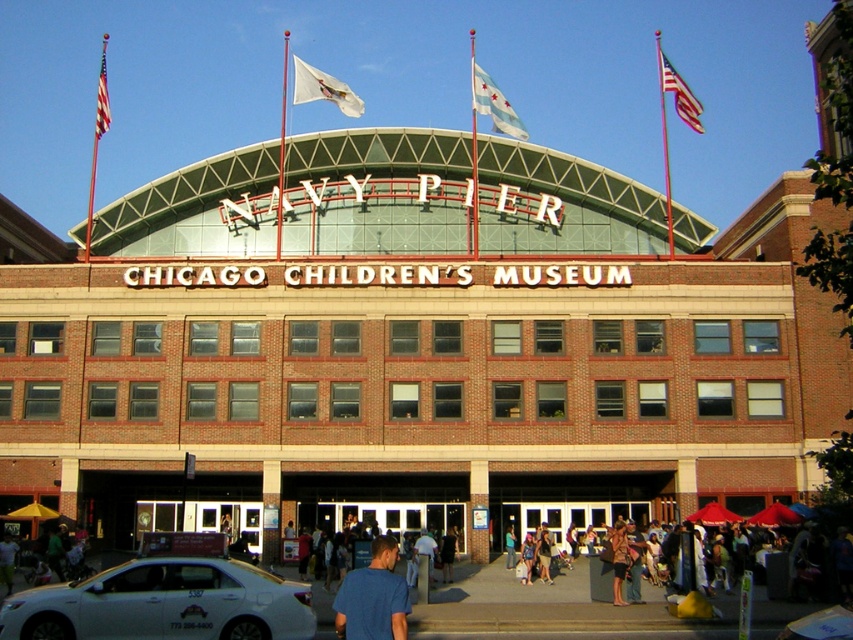
Consider the image. You are standing at the entrance of the Chicago Childrens Museum and see the white glossy sedan at lower left. If you walk straight towards the car, how far will you have to walk to reach it?

The white glossy sedan at lower left is 40.91 meters from viewer, so you will have to walk 40.91 meters to reach it.

You are a photographer planning to take a picture of the Chicago Childrens Museum entrance. You have a camera that can only focus on objects within 10 meters. The white glossy sedan at lower left is 8 meters away and the american flag at upper right is 12 meters away. Can both objects be in focus in the same photo?

The white glossy sedan at lower left is 8 meters away and the american flag at upper right is 12 meters away. Since the camera can only focus within 10 meters, the american flag at upper right is too far away to be in focus. Only the white glossy sedan at lower left will be in focus.